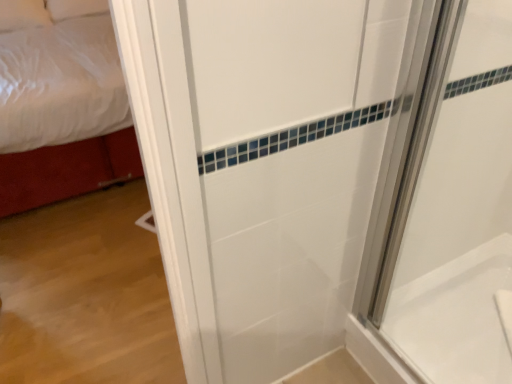
Measure the distance between white fabric bed at left and camera.

A distance of 6.75 feet exists between white fabric bed at left and camera.

Identify the location of white glossy shower door at right. The height and width of the screenshot is (384, 512). (445, 203).

What are the coordinates of `white fabric bed at left` in the screenshot? It's located at (63, 113).

Can you confirm if white glossy bathtub at lower right is smaller than white fabric bed at left?

Correct, white glossy bathtub at lower right occupies less space than white fabric bed at left.

Which point is more forward, (496,352) or (59,79)?

The point (496,352) is more forward.

Based on the photo, is white glossy bathtub at lower right positioned in front of white fabric bed at left?

Yes, white glossy bathtub at lower right is closer to the camera.

Is white glossy bathtub at lower right situated inside white fabric bed at left or outside?

white glossy bathtub at lower right is not inside white fabric bed at left, it's outside.

Would you say white glossy bathtub at lower right is part of white glossy shower door at right's contents?

No.

From a real-world perspective, is white glossy shower door at right located higher than white glossy bathtub at lower right?

Yes, from a real-world perspective, white glossy shower door at right is over white glossy bathtub at lower right

Is white glossy shower door at right to the left of white glossy bathtub at lower right from the viewer's perspective?

Correct, you'll find white glossy shower door at right to the left of white glossy bathtub at lower right.

Locate an element on the screen. The height and width of the screenshot is (384, 512). shower door that is above the white glossy bathtub at lower right (from a real-world perspective) is located at coordinates (445, 203).

Can you tell me how much white glossy bathtub at lower right and white glossy shower door at right differ in facing direction?

The facing directions of white glossy bathtub at lower right and white glossy shower door at right are 0.00332 degrees apart.

Looking at their sizes, would you say white glossy bathtub at lower right is wider or thinner than white glossy shower door at right?

white glossy bathtub at lower right is wider than white glossy shower door at right.

Is white glossy bathtub at lower right inside or outside of white glossy shower door at right?

white glossy bathtub at lower right exists outside the volume of white glossy shower door at right.

Is white glossy bathtub at lower right not close to white glossy shower door at right?

No, white glossy bathtub at lower right is not far away from white glossy shower door at right.

Does white fabric bed at left lie in front of white glossy shower door at right?

No, white fabric bed at left is behind white glossy shower door at right.

This screenshot has height=384, width=512. What are the coordinates of `shower door located in front of the white fabric bed at left` in the screenshot? It's located at (445, 203).

Which object is wider, white fabric bed at left or white glossy shower door at right?

With larger width is white fabric bed at left.

From the picture: From a real-world perspective, does white fabric bed at left stand above white glossy shower door at right?

Actually, white fabric bed at left is physically below white glossy shower door at right in the real world.

From the image's perspective, which one is positioned lower, white fabric bed at left or white glossy bathtub at lower right?

From the image's view, white glossy bathtub at lower right is below.

Is the position of white fabric bed at left less distant than that of white glossy bathtub at lower right?

No, white fabric bed at left is behind white glossy bathtub at lower right.

Based on their sizes in the image, would you say white fabric bed at left is bigger or smaller than white glossy bathtub at lower right?

white fabric bed at left is bigger than white glossy bathtub at lower right.

From a real-world perspective, does white glossy shower door at right stand above white fabric bed at left?

Correct, in the physical world, white glossy shower door at right is higher than white fabric bed at left.

Which point is more forward, (443, 280) or (136, 146)?

The point (443, 280) is in front.

Which object is positioned more to the right, white glossy shower door at right or white fabric bed at left?

From the viewer's perspective, white glossy shower door at right appears more on the right side.

Identify the location of bath below the white fabric bed at left (from the image's perspective). (455, 317).

Locate an element on the screen. shower door in front of the white glossy bathtub at lower right is located at coordinates (445, 203).

Estimate the real-world distances between objects in this image. Which object is further from white fabric bed at left, white glossy shower door at right or white glossy bathtub at lower right?

white glossy bathtub at lower right.

Considering their positions, is white glossy bathtub at lower right positioned closer to white glossy shower door at right than white fabric bed at left?

white glossy bathtub at lower right is positioned closer to the anchor white glossy shower door at right.

Which object lies further to the anchor point white glossy bathtub at lower right, white fabric bed at left or white glossy shower door at right?

Among the two, white fabric bed at left is located further to white glossy bathtub at lower right.

From the picture: Looking at the image, which one is located closer to white glossy bathtub at lower right, white glossy shower door at right or white fabric bed at left?

The object closer to white glossy bathtub at lower right is white glossy shower door at right.

Estimate the real-world distances between objects in this image. Which object is further from white glossy shower door at right, white fabric bed at left or white glossy bathtub at lower right?

white fabric bed at left lies further to white glossy shower door at right than the other object.

Which object lies further to the anchor point white fabric bed at left, white glossy bathtub at lower right or white glossy shower door at right?

white glossy bathtub at lower right is further to white fabric bed at left.

Find the location of `shower door between white fabric bed at left and white glossy bathtub at lower right in the horizontal direction`. shower door between white fabric bed at left and white glossy bathtub at lower right in the horizontal direction is located at coordinates (445, 203).